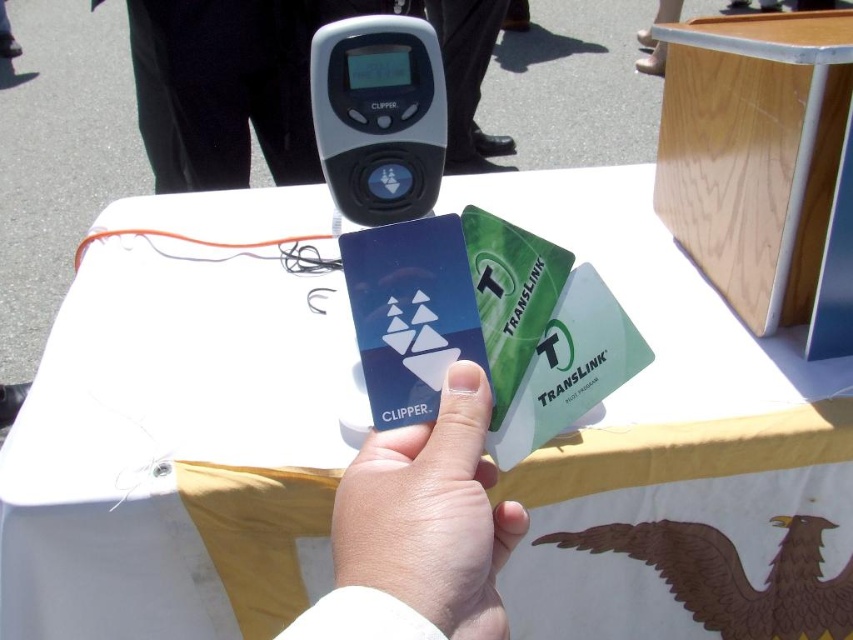
You are holding a transit card and looking at the CLIPPER card reader and the hand holding the cards. Where is the black plastic device at upper center in relation to the white matte hand at center?

The black plastic device at upper center is to the right of the white matte hand at center.

You need to place both the black plastic device at upper center and the blue plastic card at center into your pocket. Which one will you have to fold first?

The blue plastic card at center will need to be folded first because it is smaller than the black plastic device at upper center, making it easier to fold.